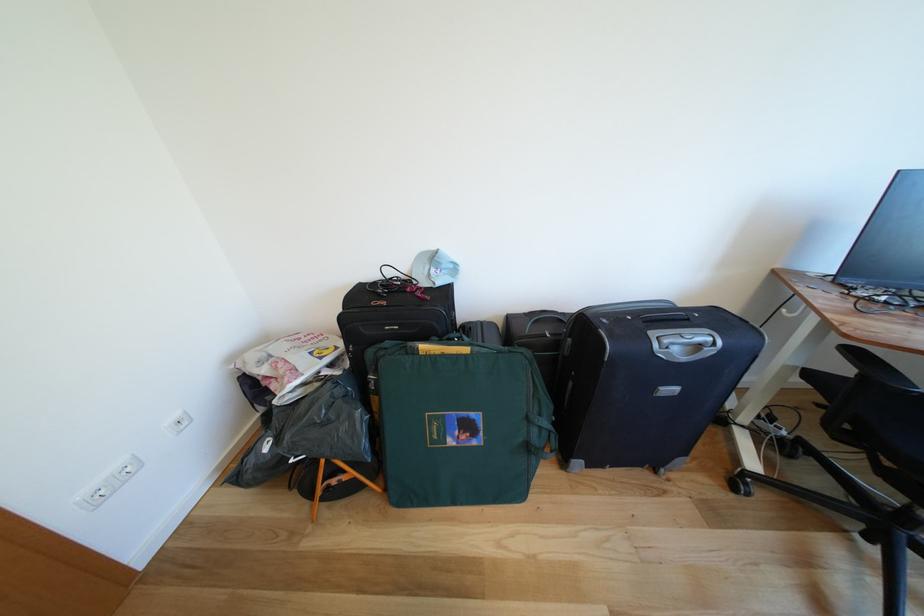
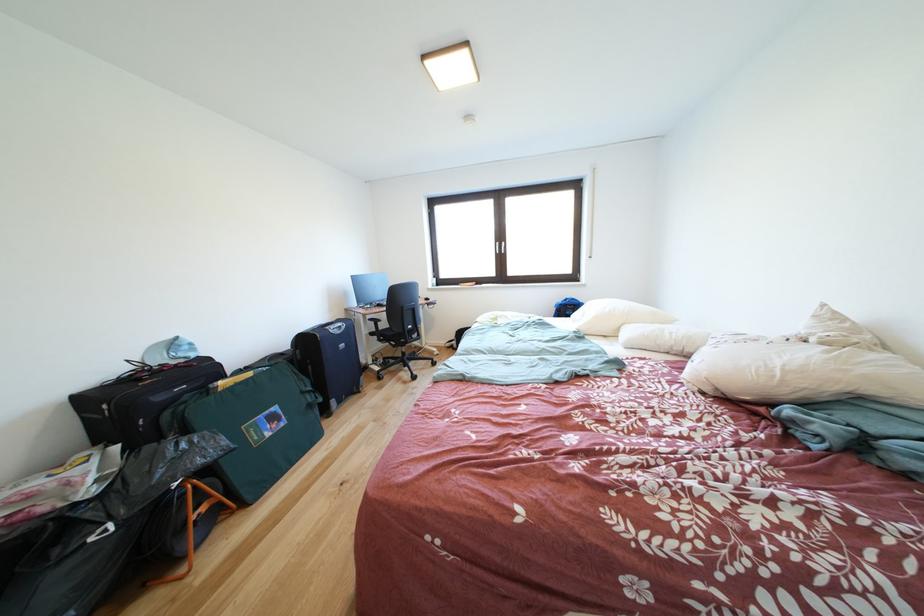
The point at (819, 379) is marked in the first image. Where is the corresponding point in the second image?

(380, 339)